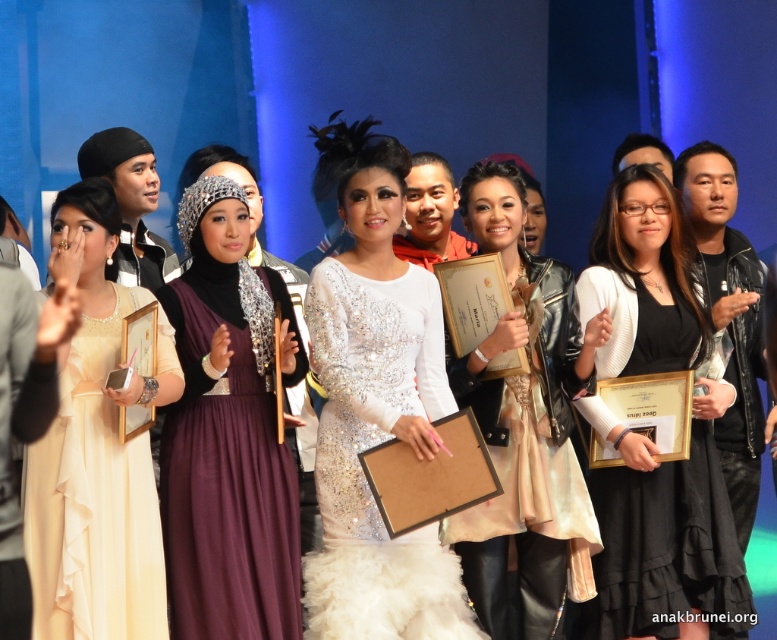
You are a photographer at an awards ceremony. You need to position a spotlight to the left of the pearl white dress at center so it illuminates the black matte dress at center. Is this possible given their positions?

Yes, because the black matte dress at center is to the right of the pearl white dress at center, placing the spotlight to the left of the pearl white dress at center will naturally direct light towards the black matte dress at center.

You are a photographer at an awards ceremony. You need to focus your camera on the central figure wearing the white sequined dress at center. Given that the camera is set to auto focus on the point at coordinates point (375,406), will the camera correctly focus on the white sequined dress at center?

Yes, the camera will correctly focus on the white sequined dress at center because the point (375,406) indicates the location of the white sequined dress at center.